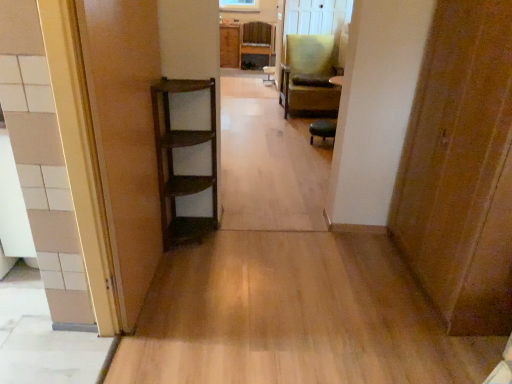
Question: In the image, is wooden chair at center, which appears as the second chair when ordered from the bottom, positioned in front of or behind wooden door at left, the 1th door from the left?

Choices:
 (A) front
 (B) behind

Answer: (B)

Question: Considering the positions of wooden chair at center, which appears as the second chair when ordered from the bottom, and wooden door at left, the second door positioned from the right, in the image, is wooden chair at center, which appears as the second chair when ordered from the bottom, wider or thinner than wooden door at left, the second door positioned from the right,?

Choices:
 (A) wide
 (B) thin

Answer: (A)

Question: Which is farther from the wooden cabinet at center?

Choices:
 (A) wooden door at right, the 2th door viewed from the left
 (B) green fabric chair at center, the first chair from the right
 (C) green leather ottoman at center
 (D) wooden door at left, the 1th door from the left
 (E) wooden chair at center, placed as the 2th chair when sorted from front to back

Answer: (A)

Question: Considering the real-world distances, which object is closest to the wooden chair at center, positioned as the second chair in right-to-left order?

Choices:
 (A) green leather ottoman at center
 (B) green fabric chair at center, the first chair viewed from the front
 (C) wooden door at left, the second door positioned from the right
 (D) wooden door at right, the 2th door viewed from the left
 (E) wooden cabinet at center

Answer: (E)